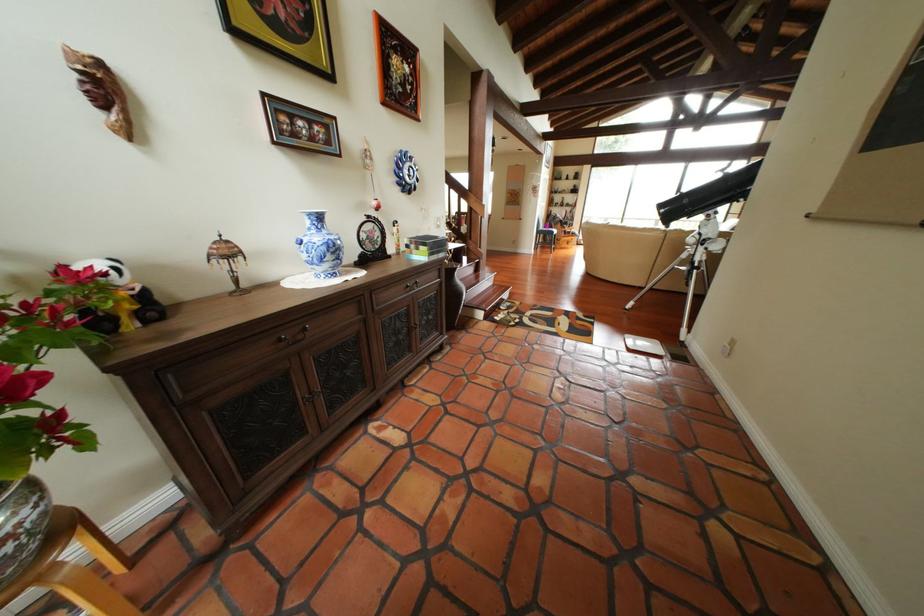
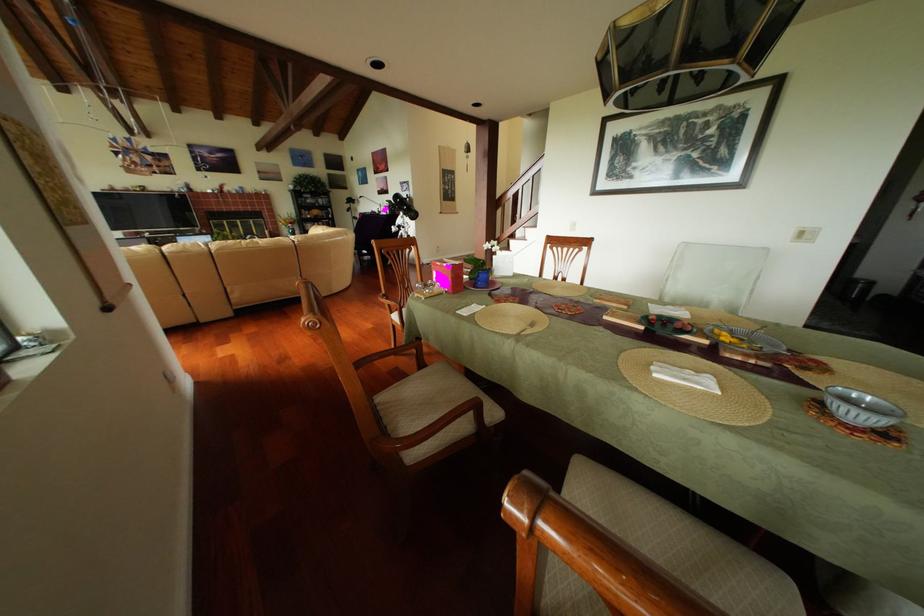
Question: I am providing you with two images of the same scene from different viewpoints. Please identify which objects are invisible in image2.

Choices:
 (A) dark drawer pull
 (B) clear glass bowl
 (C) black notebook
 (D) chair sitting surface

Answer: (A)